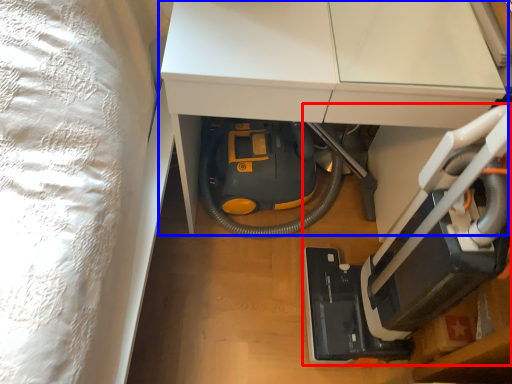
Question: Which object is closer to the camera taking this photo, equipment (highlighted by a red box) or furniture (highlighted by a blue box)?

Choices:
 (A) equipment
 (B) furniture

Answer: (A)